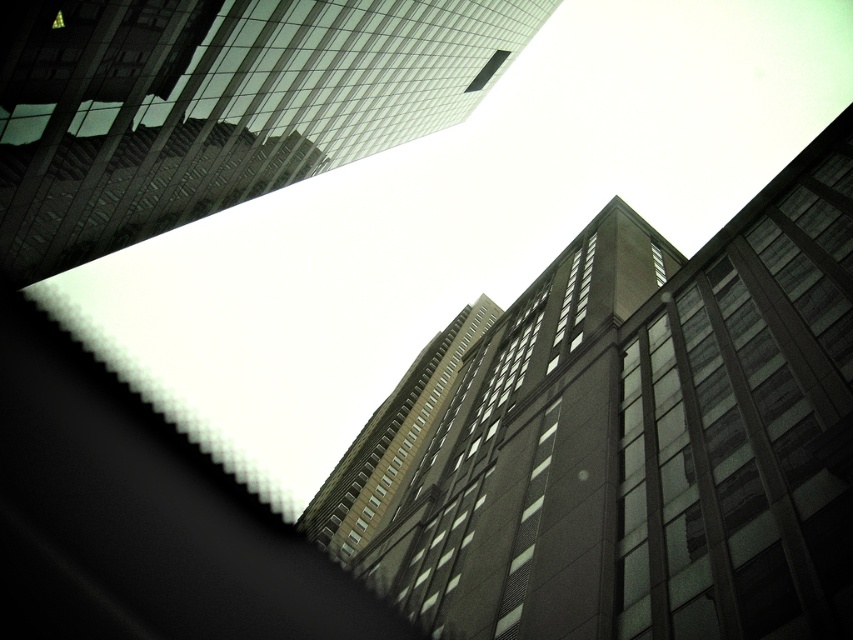
You are an urban planner analyzing the buildings in this image. You need to determine which of the two buildings, the dark gray concrete building at center or the glassy reflective skyscraper at upper center, has a wider base. Which one is wider?

The glassy reflective skyscraper at upper center has a wider base than the dark gray concrete building at center because the dark gray concrete building at center is narrower in width according to the description.

Looking up at the city skyline, you see the dark gray concrete building at center and the brown glass building at center. Which one is positioned to the right side?

The dark gray concrete building at center is positioned to the right of the brown glass building at center.